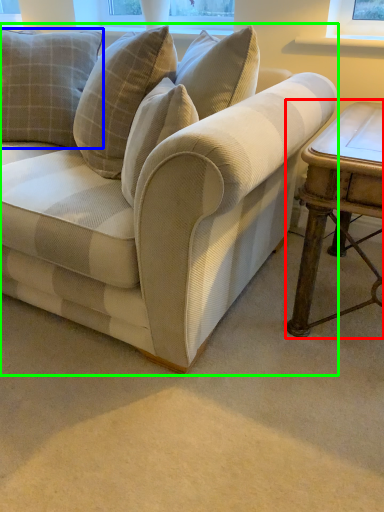
Question: Which is farther away from table (highlighted by a red box)? pillow (highlighted by a blue box) or studio couch (highlighted by a green box)?

Choices:
 (A) pillow
 (B) studio couch

Answer: (A)